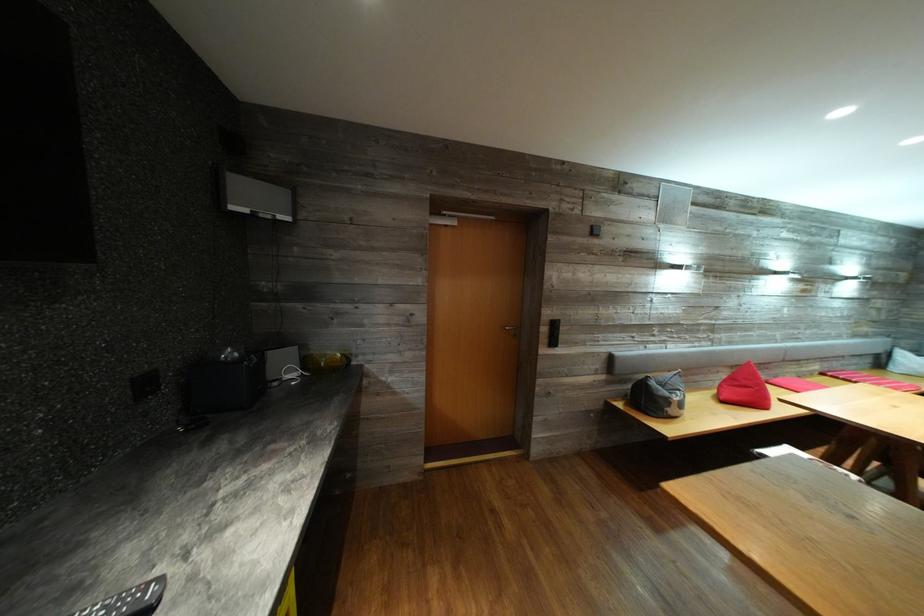
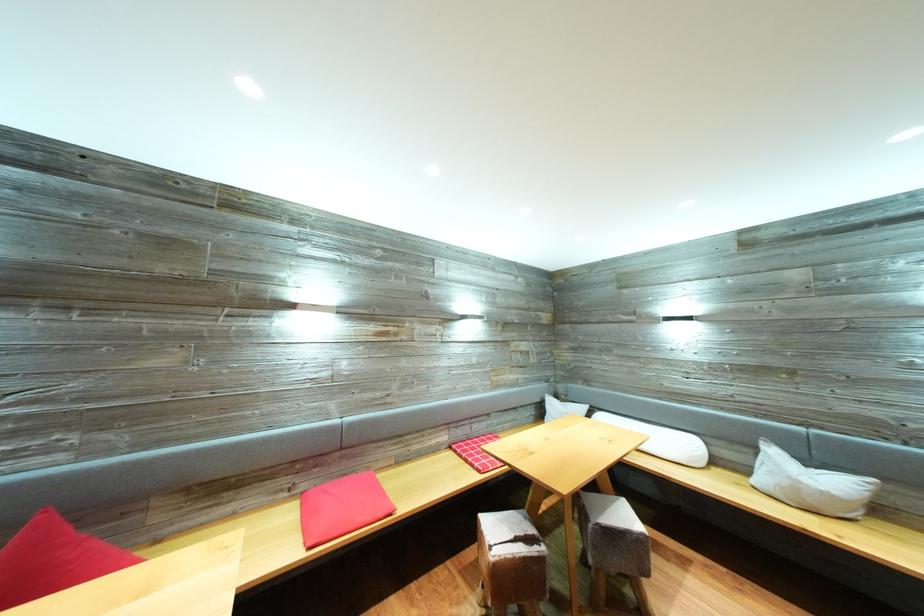
Question: What movement of the cameraman would produce the second image?

Choices:
 (A) Left
 (B) Right
 (C) Forward
 (D) Backward

Answer: (B)